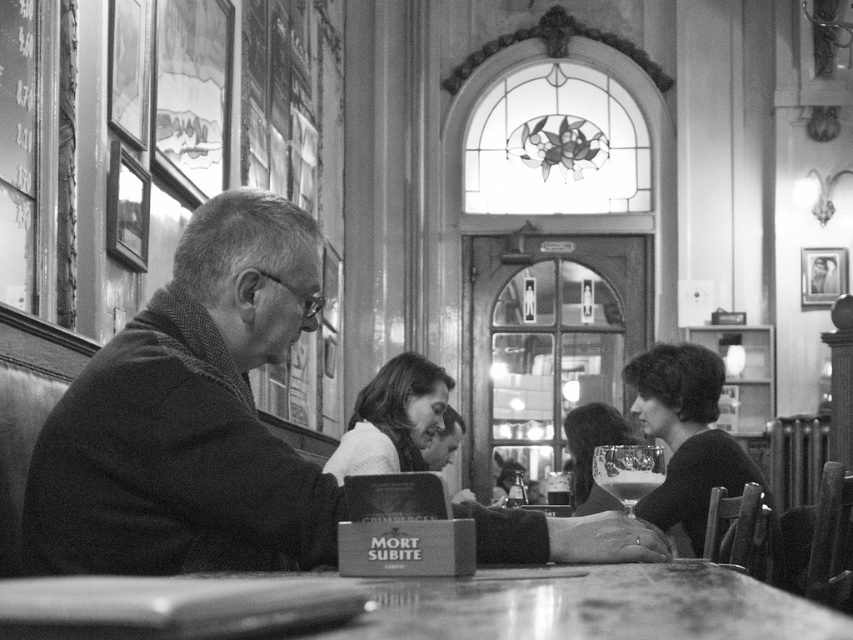
Question: Among these points, which one is farthest from the camera?

Choices:
 (A) (453, 589)
 (B) (227, 349)

Answer: (B)

Question: Can you confirm if smooth wool coat at left is wider than smooth wooden table at center?

Choices:
 (A) yes
 (B) no

Answer: (B)

Question: Considering the relative positions of smooth wool coat at left and smooth wooden table at center in the image provided, where is smooth wool coat at left located with respect to smooth wooden table at center?

Choices:
 (A) above
 (B) below

Answer: (A)

Question: Is smooth wool coat at left smaller than smooth wooden table at center?

Choices:
 (A) yes
 (B) no

Answer: (B)

Question: Which object appears closest to the camera in this image?

Choices:
 (A) smooth wool coat at left
 (B) smooth wooden table at center

Answer: (B)

Question: Which point is closer to the camera?

Choices:
 (A) (532, 529)
 (B) (656, 577)

Answer: (B)